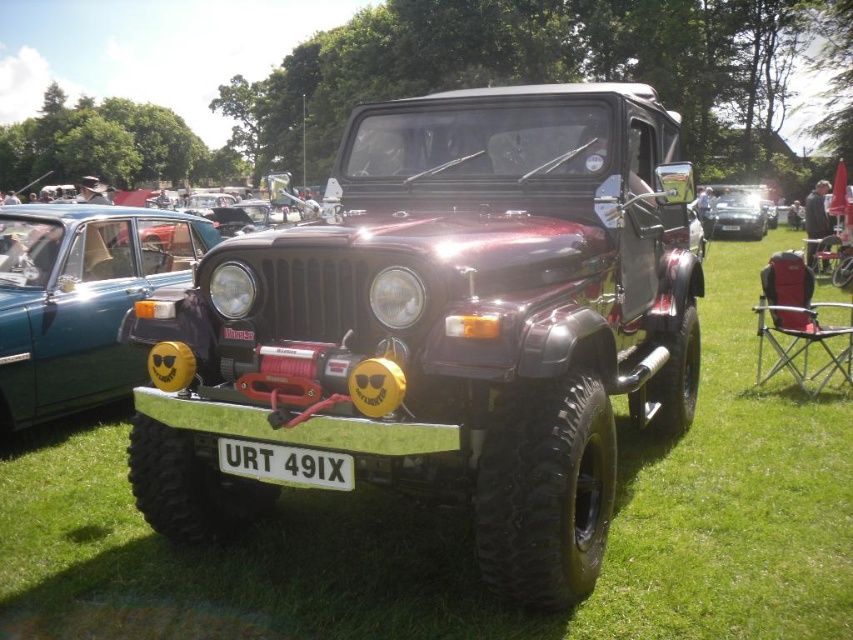
Can you confirm if metallic blue car at left is bigger than satin black car at center?

Correct, metallic blue car at left is larger in size than satin black car at center.

Does point (35, 332) lie behind point (712, 198)?

No, it is in front of (712, 198).

The width and height of the screenshot is (853, 640). In order to click on metallic blue car at left in this screenshot , I will do `click(80, 300)`.

Looking at this image, can you confirm if metallic blue car at left is taller than white plastic license plate at center?

Correct, metallic blue car at left is much taller as white plastic license plate at center.

Is point (126, 355) positioned behind point (244, 454)?

Yes.

Image resolution: width=853 pixels, height=640 pixels. I want to click on metallic blue car at left, so click(80, 300).

Can you confirm if white plastic license plate at center is positioned below satin black car at center?

Correct, white plastic license plate at center is located below satin black car at center.

Who is more forward, (343, 486) or (746, 211)?

Point (343, 486) is in front.

Who is more distant from viewer, (270, 477) or (735, 209)?

Point (735, 209)

Where is `white plastic license plate at center`? This screenshot has width=853, height=640. white plastic license plate at center is located at coordinates (285, 465).